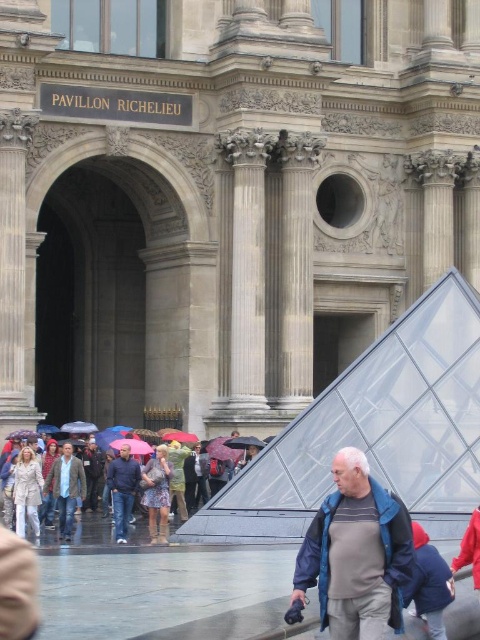
Question: Can you confirm if smooth stone column at center is wider than floral dress at center?

Choices:
 (A) yes
 (B) no

Answer: (A)

Question: Which point is farther from the camera taking this photo?

Choices:
 (A) (159, 516)
 (B) (31, 502)
 (C) (343, 486)
 (D) (299, 397)

Answer: (D)

Question: In this image, where is gray fabric jacket at lower right located relative to beige textured coat at lower left?

Choices:
 (A) above
 (B) below

Answer: (A)

Question: Which object appears farthest from the camera in this image?

Choices:
 (A) beige textured coat at lower left
 (B) floral dress at center

Answer: (B)

Question: Which point appears closest to the camera in this image?

Choices:
 (A) (24, 508)
 (B) (159, 525)
 (C) (365, 602)
 (D) (302, 282)

Answer: (C)

Question: Does gray fabric jacket at lower right have a larger size compared to floral dress at center?

Choices:
 (A) no
 (B) yes

Answer: (A)